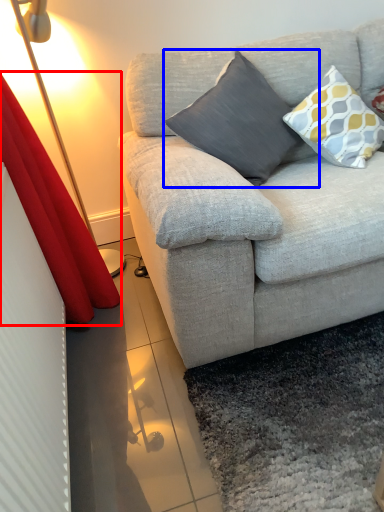
Question: Which object is further to the camera taking this photo, curtain (highlighted by a red box) or pillow (highlighted by a blue box)?

Choices:
 (A) curtain
 (B) pillow

Answer: (B)